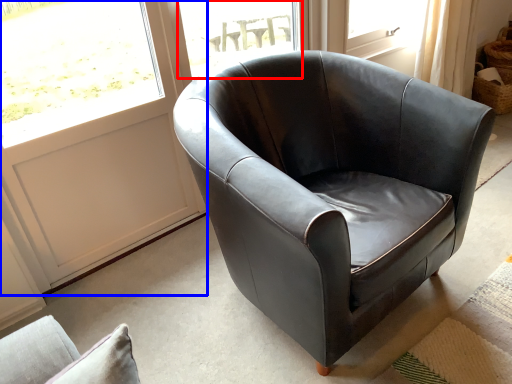
Question: Which object appears farthest to the camera in this image, window (highlighted by a red box) or screen door (highlighted by a blue box)?

Choices:
 (A) window
 (B) screen door

Answer: (A)